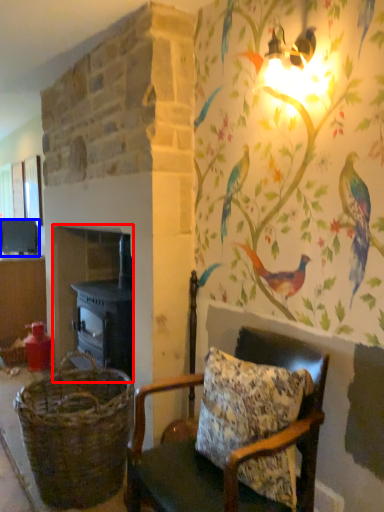
Question: Among these objects, which one is nearest to the camera, fireplace (highlighted by a red box) or appliance (highlighted by a blue box)?

Choices:
 (A) fireplace
 (B) appliance

Answer: (A)